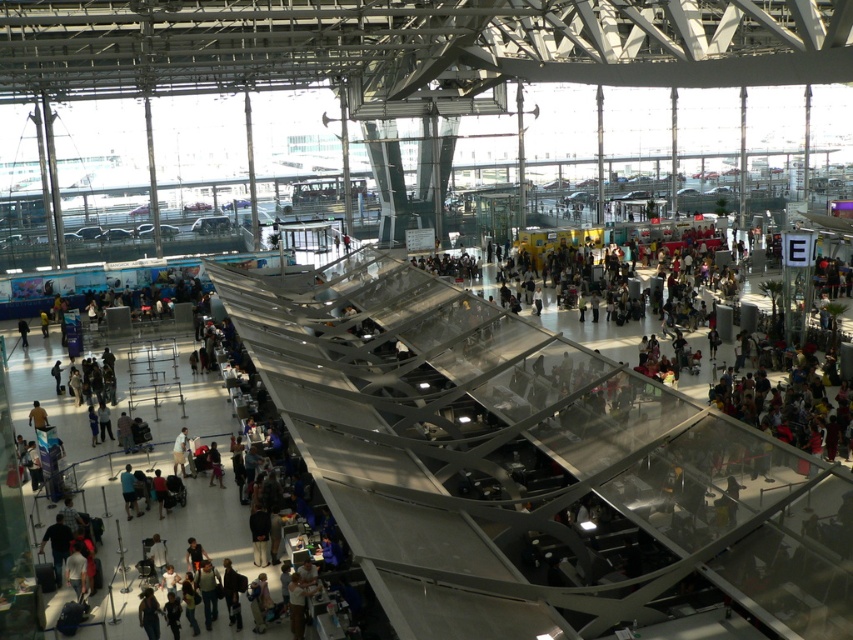
Which is more to the right, dark blue jeans at center or dark blue shirt at center?

Positioned to the right is dark blue shirt at center.

Between dark blue jeans at center and dark blue shirt at center, which one appears on the left side from the viewer's perspective?

dark blue jeans at center

Is point (126, 516) positioned behind point (160, 496)?

No.

Where is `dark blue jeans at center`? The width and height of the screenshot is (853, 640). dark blue jeans at center is located at coordinates (128, 490).

Which is below, dark blue jeans at center or light brown fabric pants at center?

dark blue jeans at center is below.

Based on the photo, who is positioned more to the left, dark blue jeans at center or light brown fabric pants at center?

From the viewer's perspective, dark blue jeans at center appears more on the left side.

Between point (134, 500) and point (184, 442), which one is positioned behind?

The point (184, 442) is behind.

This screenshot has width=853, height=640. I want to click on dark blue jeans at center, so click(128, 490).

Is light brown fabric pants at center positioned before dark blue shirt at center?

That is False.

How distant is light brown fabric pants at center from dark blue shirt at center?

light brown fabric pants at center and dark blue shirt at center are 2.54 meters apart from each other.

Who is more distant from viewer, (184, 436) or (165, 499)?

The point (184, 436) is more distant.

The height and width of the screenshot is (640, 853). Identify the location of light brown fabric pants at center. (180, 451).